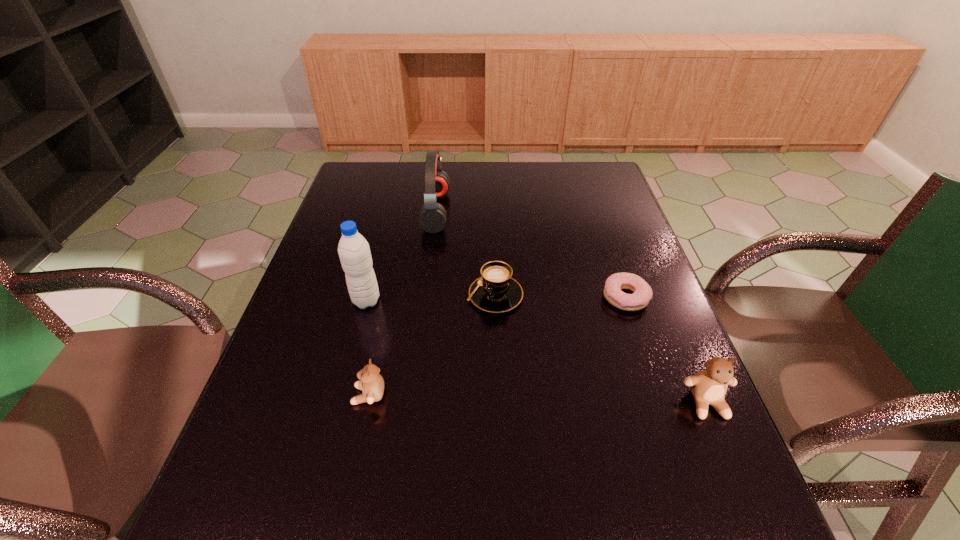
Where is `free space located 0.180m on the front-facing side of the third shortest object`? Image resolution: width=960 pixels, height=540 pixels. free space located 0.180m on the front-facing side of the third shortest object is located at coordinates (265, 395).

Where is `vacant space located on the front-facing side of the third shortest object`? vacant space located on the front-facing side of the third shortest object is located at coordinates (279, 395).

Locate an element on the screen. This screenshot has width=960, height=540. free region located 0.060m on the front-facing side of the taller teddy bear is located at coordinates (727, 451).

You are a GUI agent. You are given a task and a screenshot of the screen. Output one action in this format:
    pyautogui.click(x=<x>, y=<y>)
    Task: Click on the free spot located 0.070m on the ear cups of the farthest object
    The image size is (960, 540).
    Given the screenshot: What is the action you would take?
    pyautogui.click(x=471, y=211)

At what (x,y) coordinates should I click in order to perform the action: click on free space located on the front of the water bottle. Please return your answer as a coordinate pair (x, y). Looking at the image, I should click on (358, 333).

Image resolution: width=960 pixels, height=540 pixels. In order to click on free space located 0.160m on the back of the cappuccino in this screenshot , I will do `click(493, 239)`.

In order to click on free space located 0.320m on the front of the shortest object in this screenshot , I will do `click(674, 440)`.

Where is `object that is at the far edge`? This screenshot has width=960, height=540. object that is at the far edge is located at coordinates pos(432,218).

What are the coordinates of `object present at the left edge` in the screenshot? It's located at (354, 252).

Image resolution: width=960 pixels, height=540 pixels. Identify the location of teddy bear that is at the right edge. (709, 386).